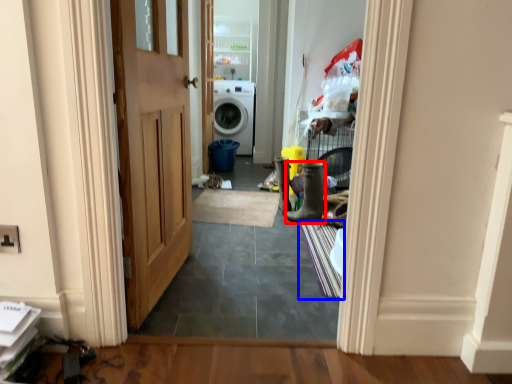
Question: Which object appears farthest to the camera in this image, boot (highlighted by a red box) or doormat (highlighted by a blue box)?

Choices:
 (A) boot
 (B) doormat

Answer: (A)